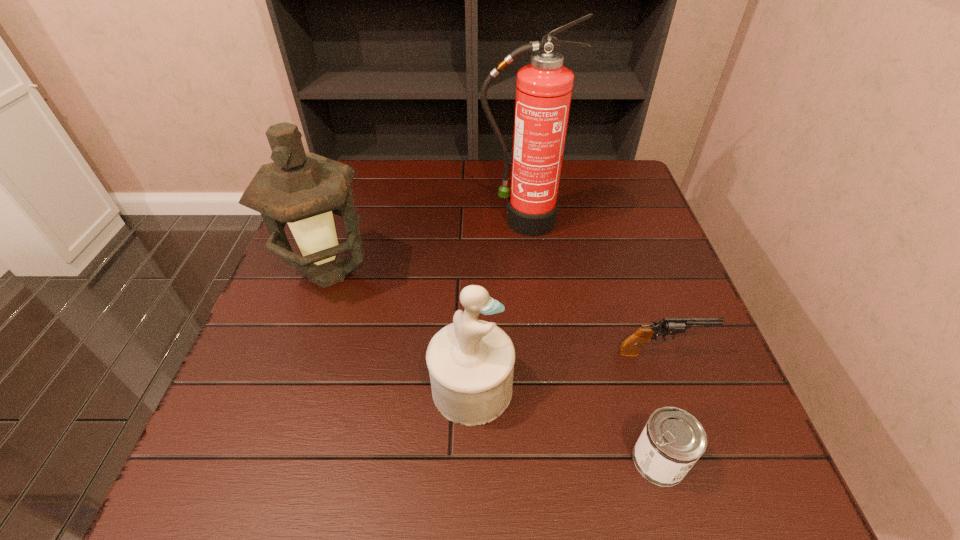
This screenshot has height=540, width=960. Identify the location of blank space at the near left corner. (278, 464).

Where is `free spot between the figurine and the gun`? The height and width of the screenshot is (540, 960). free spot between the figurine and the gun is located at coordinates (566, 370).

This screenshot has height=540, width=960. I want to click on free space between the gun and the nearest object, so point(660,406).

This screenshot has height=540, width=960. Identify the location of free spot between the leftmost object and the figurine. (400, 330).

I want to click on empty location between the gun and the farthest object, so click(x=591, y=287).

Identify the location of free point between the fire extinguisher and the leftmost object. (425, 247).

Where is `vacant point located between the can and the gun`? vacant point located between the can and the gun is located at coordinates (660, 406).

The width and height of the screenshot is (960, 540). In order to click on object that is the second nearest to the leftmost object in this screenshot , I will do `click(544, 88)`.

Point out which object is positioned as the fourth nearest to the third shortest object. Please provide its 2D coordinates. Your answer should be formatted as a tuple, i.e. [(x, y)], where the tuple contains the x and y coordinates of a point satisfying the conditions above.

[(544, 88)]

Find the location of `free space in the image that satisfies the following two spatial constraints: 1. on the front-facing side of the tallest object; 2. on the right side of the nearest object`. free space in the image that satisfies the following two spatial constraints: 1. on the front-facing side of the tallest object; 2. on the right side of the nearest object is located at coordinates (547, 460).